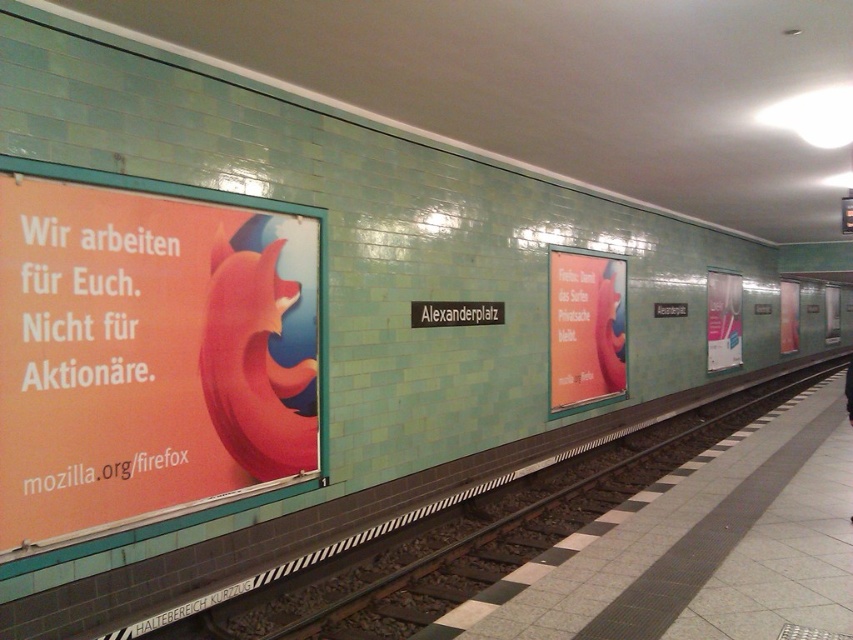
Question: From the image, what is the correct spatial relationship of smooth concrete platform at center in relation to white glossy poster at right?

Choices:
 (A) left
 (B) right

Answer: (A)

Question: Which point is closer to the camera taking this photo?

Choices:
 (A) (593, 532)
 (B) (578, 282)

Answer: (A)

Question: Based on their relative distances, which object is farther from the orange matte fox at left?

Choices:
 (A) white glossy poster at right
 (B) smooth concrete platform at center

Answer: (A)

Question: Among these points, which one is farthest from the camera?

Choices:
 (A) (682, 472)
 (B) (735, 289)
 (C) (19, 429)
 (D) (602, 292)

Answer: (B)

Question: Is orange matte fox at left closer to camera compared to matte pink poster at center?

Choices:
 (A) yes
 (B) no

Answer: (A)

Question: In this image, where is orange matte fox at left located relative to white glossy poster at right?

Choices:
 (A) below
 (B) above

Answer: (A)